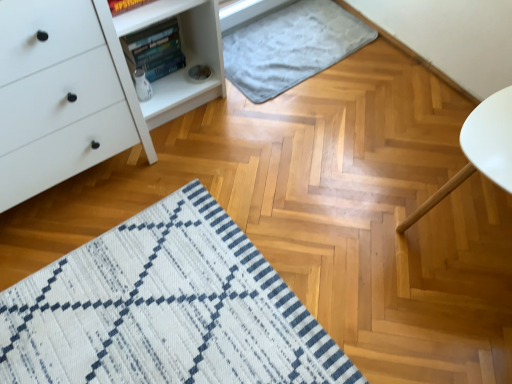
Question: Can you confirm if white matte chest of drawers at left is wider than gray soft rug at upper center?

Choices:
 (A) no
 (B) yes

Answer: (A)

Question: Does white matte chest of drawers at left have a lesser width compared to gray soft rug at upper center?

Choices:
 (A) yes
 (B) no

Answer: (A)

Question: Can you confirm if white matte chest of drawers at left is positioned to the left of gray soft rug at upper center?

Choices:
 (A) no
 (B) yes

Answer: (B)

Question: Would you say white matte chest of drawers at left is outside gray soft rug at upper center?

Choices:
 (A) no
 (B) yes

Answer: (B)

Question: Can you confirm if white matte chest of drawers at left is smaller than gray soft rug at upper center?

Choices:
 (A) yes
 (B) no

Answer: (B)

Question: In the image, is white matte table at right on the left side or the right side of white matte chest of drawers at left?

Choices:
 (A) right
 (B) left

Answer: (A)

Question: Considering the positions of white matte table at right and white matte chest of drawers at left in the image, is white matte table at right bigger or smaller than white matte chest of drawers at left?

Choices:
 (A) big
 (B) small

Answer: (B)

Question: Is point (507, 104) positioned closer to the camera than point (65, 49)?

Choices:
 (A) closer
 (B) farther

Answer: (B)

Question: Relative to white matte chest of drawers at left, is white matte table at right in front or behind?

Choices:
 (A) front
 (B) behind

Answer: (B)

Question: Do you think hardcover book at upper left is within gray soft rug at upper center, or outside of it?

Choices:
 (A) inside
 (B) outside

Answer: (B)

Question: Based on their sizes in the image, would you say hardcover book at upper left is bigger or smaller than gray soft rug at upper center?

Choices:
 (A) small
 (B) big

Answer: (A)

Question: Does point (175, 41) appear closer or farther from the camera than point (344, 43)?

Choices:
 (A) farther
 (B) closer

Answer: (B)

Question: Considering their positions, is hardcover book at upper left located in front of or behind gray soft rug at upper center?

Choices:
 (A) front
 (B) behind

Answer: (A)

Question: Does point (471, 147) appear closer or farther from the camera than point (330, 3)?

Choices:
 (A) farther
 (B) closer

Answer: (B)

Question: From a real-world perspective, is white matte table at right positioned above or below gray soft rug at upper center?

Choices:
 (A) below
 (B) above

Answer: (B)